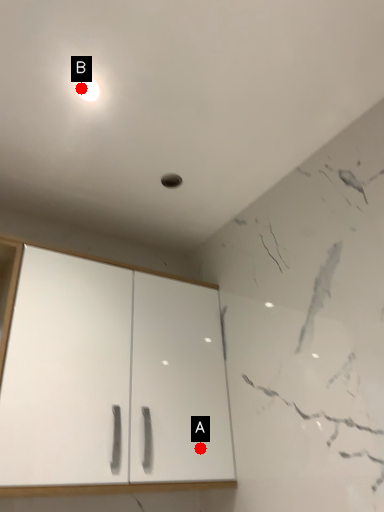
Question: Two points are circled on the image, labeled by A and B beside each circle. Which point appears farthest from the camera in this image?

Choices:
 (A) A is further
 (B) B is further

Answer: (A)